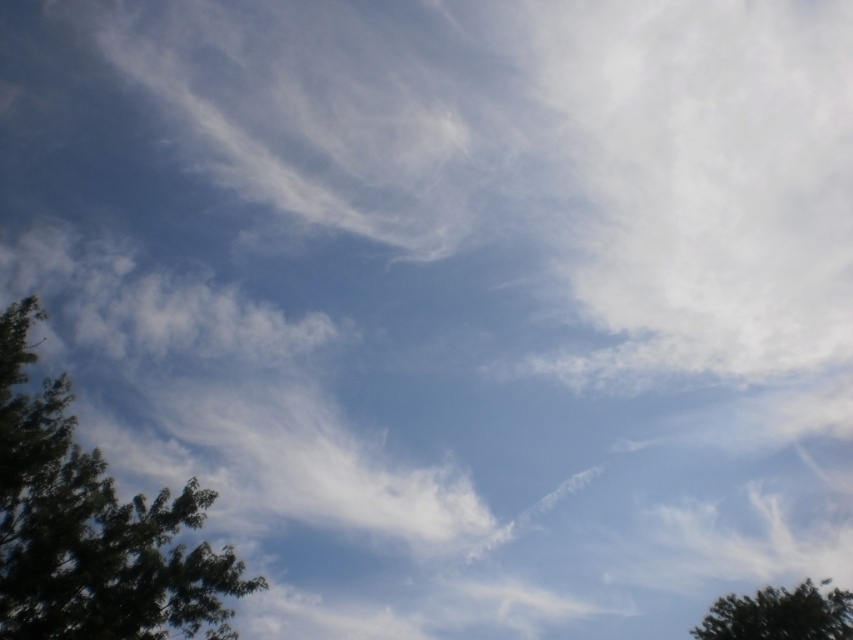
You are standing in the middle of the image and looking towards the bottom left corner where the tree is. There is a point labeled as point (91, 528). Can you tell me what is located at that point?

The point (91, 528) is located on the green leafy tree at left.

You are standing in a field looking at the sky scene described. You notice two green leafy trees in the distance. Which tree, the green leafy tree at left or the green leafy tree at lower right, appears closer to you based on their sizes?

The green leafy tree at left appears closer because it has a smaller size compared to the green leafy tree at lower right, which suggests it is farther away.